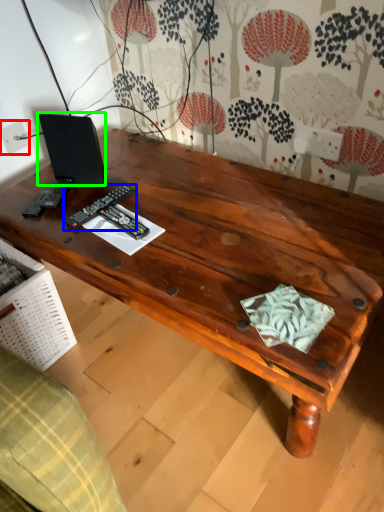
Question: Estimate the real-world distances between objects in this image. Which object is closer to electric outlet (highlighted by a red box), control (highlighted by a blue box) or speaker (highlighted by a green box)?

Choices:
 (A) control
 (B) speaker

Answer: (B)